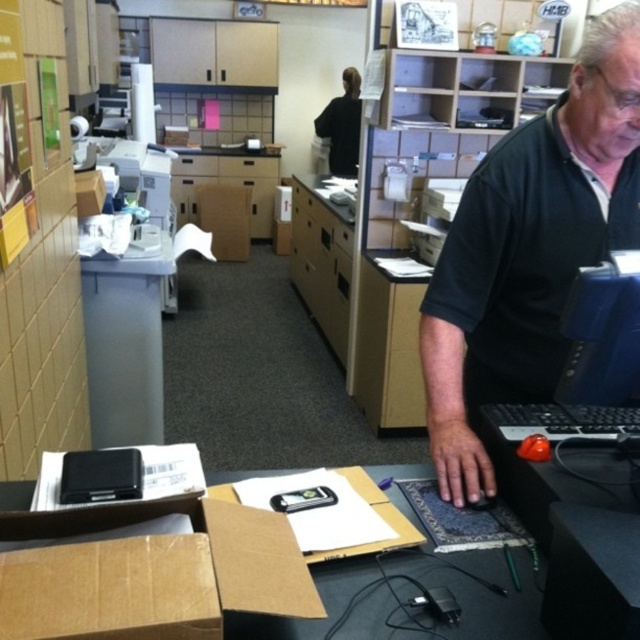
Which is above, brown cardboard box at lower left or brown cardboard box at center?

brown cardboard box at center is higher up.

Does brown cardboard box at lower left have a larger size compared to brown cardboard box at center?

No.

What do you see at coordinates (221, 579) in the screenshot?
I see `brown cardboard box at lower left` at bounding box center [221, 579].

Identify the location of brown cardboard box at lower left. (221, 579).

Is black matte shirt at right above black glossy monitor at upper right?

Yes.

Does black matte shirt at right lie in front of black glossy monitor at upper right?

No, black matte shirt at right is behind black glossy monitor at upper right.

Where is `black matte shirt at right`? The image size is (640, 640). black matte shirt at right is located at coordinates (529, 250).

Which is above, wooden file cabinet at center or brown cardboard box at center?

brown cardboard box at center is above.

Who is more distant from viewer, (x=304, y=285) or (x=244, y=240)?

Positioned behind is point (x=244, y=240).

You are a GUI agent. You are given a task and a screenshot of the screen. Output one action in this format:
    pyautogui.click(x=<x>, y=<y>)
    Task: Click on the wooden file cabinet at center
    This screenshot has width=640, height=640.
    Given the screenshot: What is the action you would take?
    pyautogui.click(x=321, y=266)